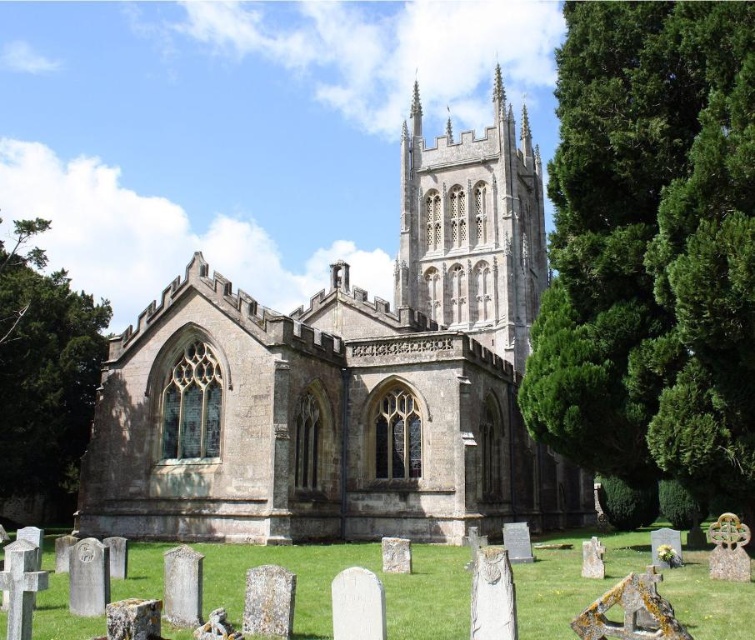
Does green leafy tree at left have a lesser height compared to smooth stone spire at upper center?

No, green leafy tree at left is not shorter than smooth stone spire at upper center.

Is green leafy tree at left wider than smooth stone spire at upper center?

Correct, the width of green leafy tree at left exceeds that of smooth stone spire at upper center.

Does point (91, 385) come closer to viewer compared to point (411, 120)?

Yes, point (91, 385) is closer to viewer.

Identify the location of green leafy tree at left. (45, 374).

Who is positioned more to the right, stone gothic tower at center or smooth stone spire at upper center?

From the viewer's perspective, stone gothic tower at center appears more on the right side.

Between point (504, 177) and point (411, 131), which one is positioned behind?

Point (411, 131)

Between point (473, 140) and point (414, 125), which one is positioned in front?

Point (473, 140)

Locate an element on the screen. stone gothic tower at center is located at coordinates (473, 230).

In order to click on stone church at center in this screenshot , I will do click(x=347, y=381).